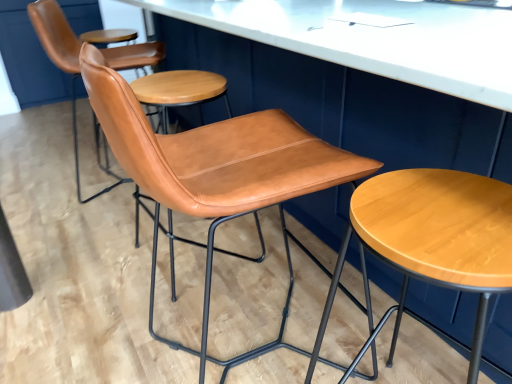
Question: Is cognac leather chair at center, which is counted as the 3th chair, starting from the back, further to the viewer compared to cognac leather chair at center, marked as the 1th chair in a back-to-front arrangement?

Choices:
 (A) yes
 (B) no

Answer: (B)

Question: Is cognac leather chair at center, arranged as the 1th chair when viewed from the front, thinner than cognac leather chair at center, marked as the 3th chair in a front-to-back arrangement?

Choices:
 (A) yes
 (B) no

Answer: (B)

Question: From a real-world perspective, is cognac leather chair at center, arranged as the 1th chair when viewed from the front, located higher than cognac leather chair at center, marked as the 3th chair in a front-to-back arrangement?

Choices:
 (A) yes
 (B) no

Answer: (A)

Question: From a real-world perspective, is cognac leather chair at center, arranged as the 1th chair when viewed from the front, under cognac leather chair at center, marked as the 3th chair in a front-to-back arrangement?

Choices:
 (A) yes
 (B) no

Answer: (B)

Question: Is cognac leather chair at center, which is counted as the 3th chair, starting from the back, next to cognac leather chair at center, marked as the 1th chair in a back-to-front arrangement?

Choices:
 (A) yes
 (B) no

Answer: (B)

Question: Can you confirm if cognac leather chair at center, arranged as the 1th chair when viewed from the front, is shorter than cognac leather chair at center, marked as the 1th chair in a back-to-front arrangement?

Choices:
 (A) no
 (B) yes

Answer: (B)

Question: From the image's perspective, is cognac leather chair at center, marked as the 1th chair in a back-to-front arrangement, on top of cognac leather chair at center, the second chair viewed from the front?

Choices:
 (A) no
 (B) yes

Answer: (B)

Question: Is cognac leather chair at center, marked as the 1th chair in a back-to-front arrangement, outside of cognac leather chair at center, the second chair viewed from the front?

Choices:
 (A) no
 (B) yes

Answer: (B)

Question: Is cognac leather chair at center, marked as the 3th chair in a front-to-back arrangement, to the right of cognac leather chair at center, the 2th chair when ordered from back to front, from the viewer's perspective?

Choices:
 (A) no
 (B) yes

Answer: (A)

Question: Considering the relative sizes of cognac leather chair at center, marked as the 1th chair in a back-to-front arrangement, and cognac leather chair at center, the 2th chair when ordered from back to front, in the image provided, is cognac leather chair at center, marked as the 1th chair in a back-to-front arrangement, bigger than cognac leather chair at center, the 2th chair when ordered from back to front,?

Choices:
 (A) no
 (B) yes

Answer: (B)

Question: Considering the relative sizes of cognac leather chair at center, marked as the 1th chair in a back-to-front arrangement, and cognac leather chair at center, the 2th chair when ordered from back to front, in the image provided, is cognac leather chair at center, marked as the 1th chair in a back-to-front arrangement, thinner than cognac leather chair at center, the 2th chair when ordered from back to front,?

Choices:
 (A) no
 (B) yes

Answer: (A)

Question: Is cognac leather chair at center, marked as the 3th chair in a front-to-back arrangement, facing towards cognac leather chair at center, the second chair viewed from the front?

Choices:
 (A) yes
 (B) no

Answer: (B)

Question: From a real-world perspective, is cognac leather chair at center, marked as the 1th chair in a back-to-front arrangement, on top of cognac leather chair at center, arranged as the 1th chair when viewed from the front?

Choices:
 (A) yes
 (B) no

Answer: (B)